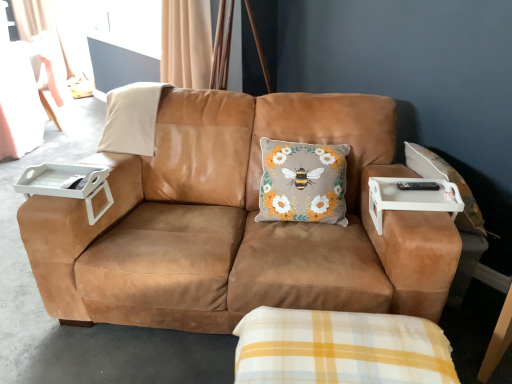
Question: From the image's perspective, would you say white plastic tray at right, the 1th table from the right, is shown under floral-patterned fabric cushion at center?

Choices:
 (A) no
 (B) yes

Answer: (B)

Question: Is white plastic tray at right, the 1th table from the right, oriented away from floral-patterned fabric cushion at center?

Choices:
 (A) no
 (B) yes

Answer: (A)

Question: From a real-world perspective, is white plastic tray at right, the 1th table from the right, physically above floral-patterned fabric cushion at center?

Choices:
 (A) no
 (B) yes

Answer: (B)

Question: Is white plastic tray at right, the 1th table from the right, touching floral-patterned fabric cushion at center?

Choices:
 (A) yes
 (B) no

Answer: (B)

Question: From a real-world perspective, is white plastic tray at right, the second table viewed from the left, beneath floral-patterned fabric cushion at center?

Choices:
 (A) yes
 (B) no

Answer: (B)

Question: Can you confirm if white plastic tray at right, the 1th table from the right, is smaller than floral-patterned fabric cushion at center?

Choices:
 (A) no
 (B) yes

Answer: (B)

Question: Is the position of suede brown couch at center more distant than that of beige suede pillow at upper left?

Choices:
 (A) no
 (B) yes

Answer: (A)

Question: Considering the relative sizes of suede brown couch at center and beige suede pillow at upper left in the image provided, is suede brown couch at center smaller than beige suede pillow at upper left?

Choices:
 (A) no
 (B) yes

Answer: (A)

Question: Is there a large distance between suede brown couch at center and beige suede pillow at upper left?

Choices:
 (A) yes
 (B) no

Answer: (B)

Question: Is suede brown couch at center touching beige suede pillow at upper left?

Choices:
 (A) no
 (B) yes

Answer: (A)

Question: Considering the relative positions of suede brown couch at center and beige suede pillow at upper left in the image provided, is suede brown couch at center to the right of beige suede pillow at upper left from the viewer's perspective?

Choices:
 (A) yes
 (B) no

Answer: (A)

Question: Can you confirm if suede brown couch at center is taller than beige suede pillow at upper left?

Choices:
 (A) yes
 (B) no

Answer: (A)

Question: Could you tell me if floral-patterned fabric cushion at center is turned towards beige suede pillow at upper left?

Choices:
 (A) no
 (B) yes

Answer: (A)